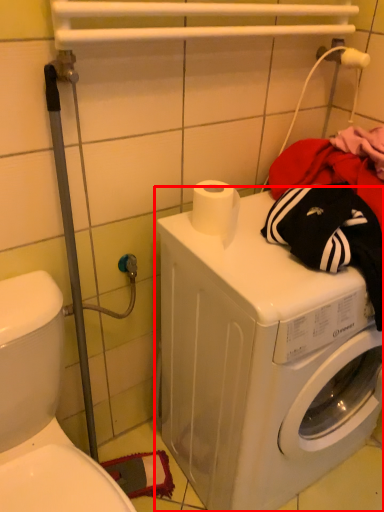
Question: In this image, where is washing machine (annotated by the red box) located relative to washer?

Choices:
 (A) left
 (B) right

Answer: (B)